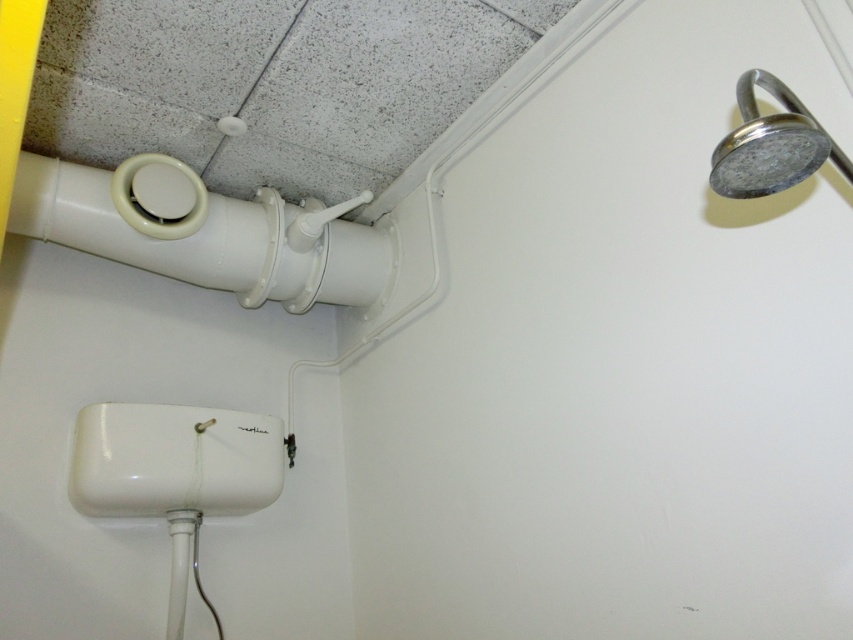
Question: Can you confirm if chrome metallic shower head at upper right is positioned to the left of white glossy pipe at lower left?

Choices:
 (A) yes
 (B) no

Answer: (B)

Question: Based on their relative distances, which object is farther from the white plastic pipe at upper left?

Choices:
 (A) chrome metallic shower head at upper right
 (B) white glossy pipe at lower left

Answer: (A)

Question: Considering the real-world distances, which object is closest to the chrome metallic shower head at upper right?

Choices:
 (A) white glossy pipe at lower left
 (B) white plastic pipe at upper left

Answer: (B)

Question: Which point is farther from the camera taking this photo?

Choices:
 (A) (131, 236)
 (B) (791, 104)
 (C) (184, 573)

Answer: (A)

Question: Does white plastic pipe at upper left appear under white glossy pipe at lower left?

Choices:
 (A) yes
 (B) no

Answer: (B)

Question: Does chrome metallic shower head at upper right have a smaller size compared to white glossy pipe at lower left?

Choices:
 (A) no
 (B) yes

Answer: (A)